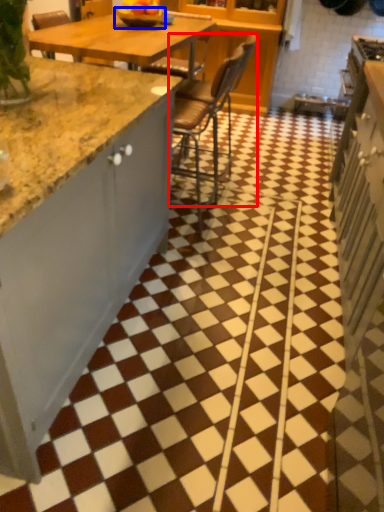
Question: Which point is closer to the camera, chair (highlighted by a red box) or bowl (highlighted by a blue box)?

Choices:
 (A) chair
 (B) bowl

Answer: (A)